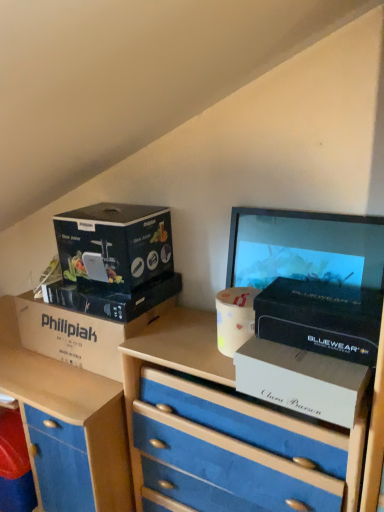
At what (x,y) coordinates should I click in order to perform the action: click on free spot above black matte box at center-right, which appears as the 1th box when viewed from the right (from a real-world perspective). Please return your answer as a coordinate pair (x, y). The width and height of the screenshot is (384, 512). Looking at the image, I should click on (329, 292).